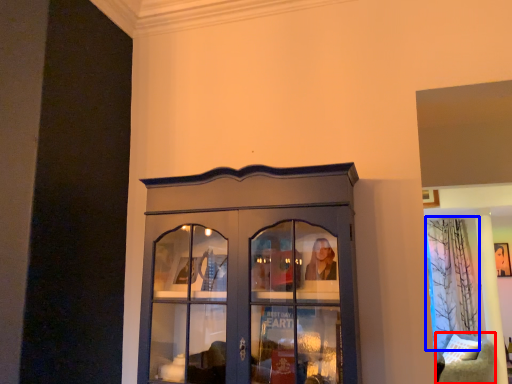
Question: Which object is closer to the camera taking this photo, furniture (highlighted by a red box) or curtain (highlighted by a blue box)?

Choices:
 (A) furniture
 (B) curtain

Answer: (A)